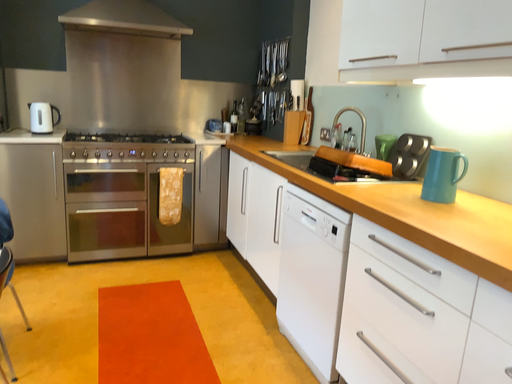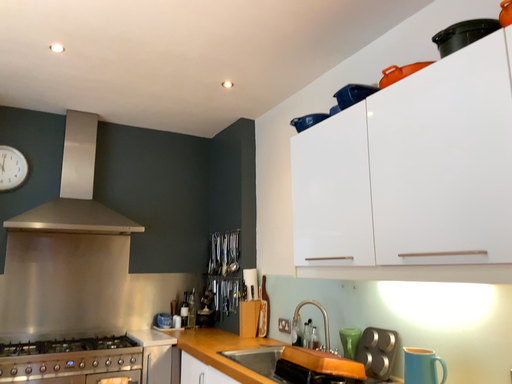
Question: Which way did the camera rotate in the video?

Choices:
 (A) rotated left
 (B) rotated right

Answer: (B)